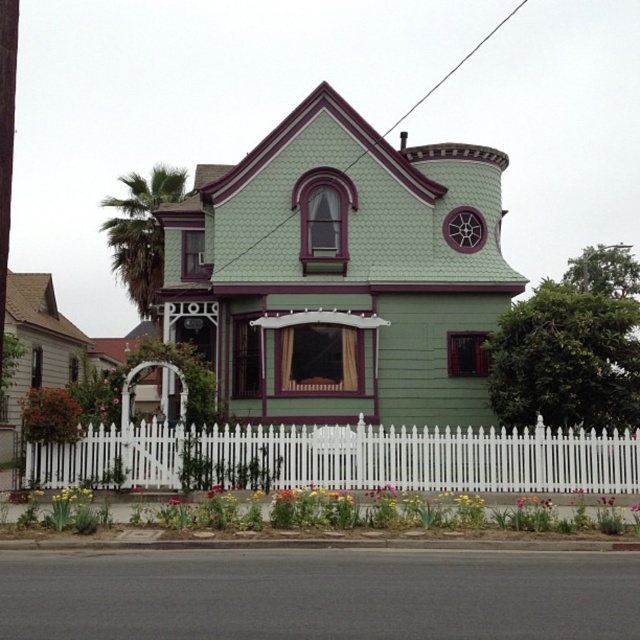
Question: Is white picket fence at lower center positioned in front of green leafy palm tree at left?

Choices:
 (A) no
 (B) yes

Answer: (B)

Question: Is white picket fence at lower center bigger than green leafy palm tree at left?

Choices:
 (A) no
 (B) yes

Answer: (A)

Question: Is white picket fence at lower center below green leafy palm tree at left?

Choices:
 (A) yes
 (B) no

Answer: (A)

Question: Which object is farther from the camera taking this photo?

Choices:
 (A) white picket fence at lower center
 (B) green leafy palm tree at left

Answer: (B)

Question: Which point is closer to the camera?

Choices:
 (A) green leafy palm tree at left
 (B) white picket fence at lower center

Answer: (B)